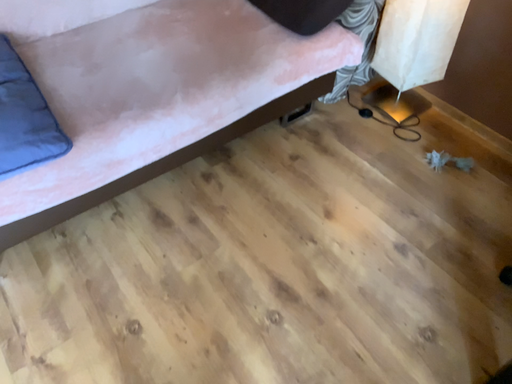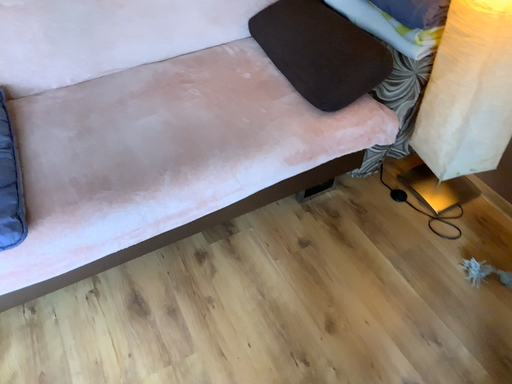
Question: Which way did the camera rotate in the video?

Choices:
 (A) rotated right
 (B) rotated left

Answer: (B)